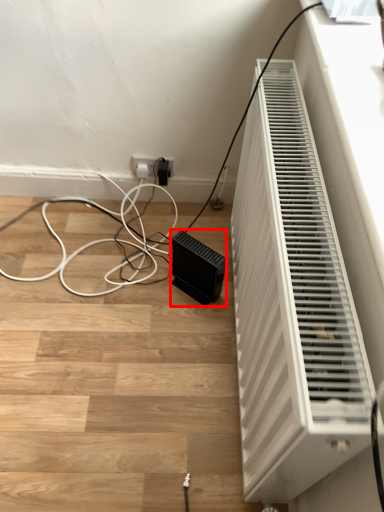
Question: Considering the relative positions of speaker (annotated by the red box) and home appliance in the image provided, where is speaker (annotated by the red box) located with respect to the staircase?

Choices:
 (A) right
 (B) left

Answer: (B)